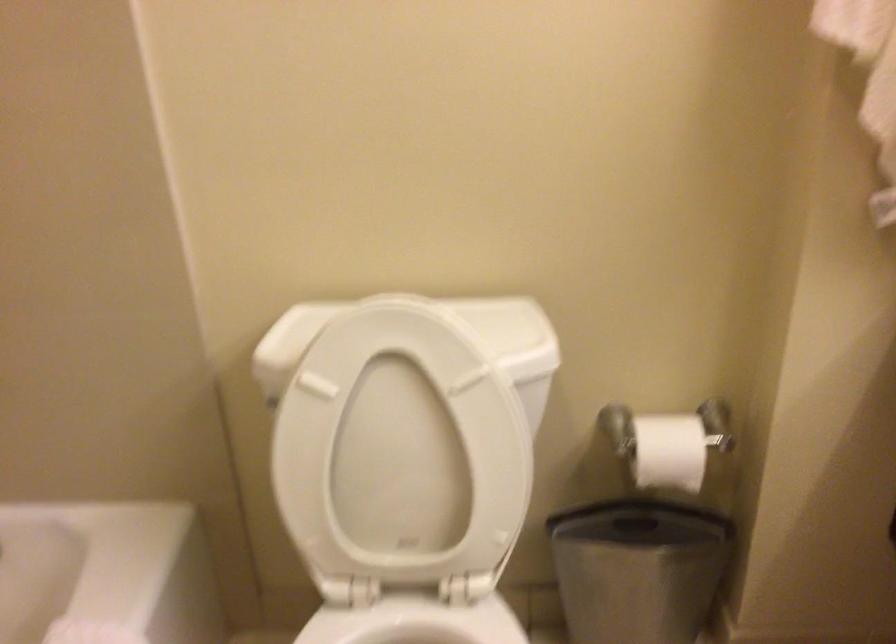
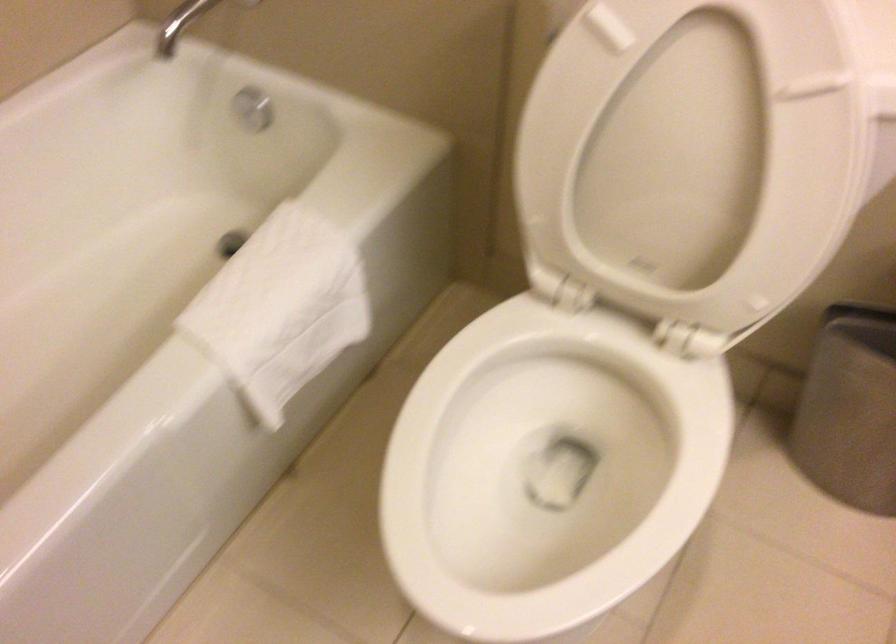
Find the pixel in the second image that matches point 410,451 in the first image.

(691, 154)